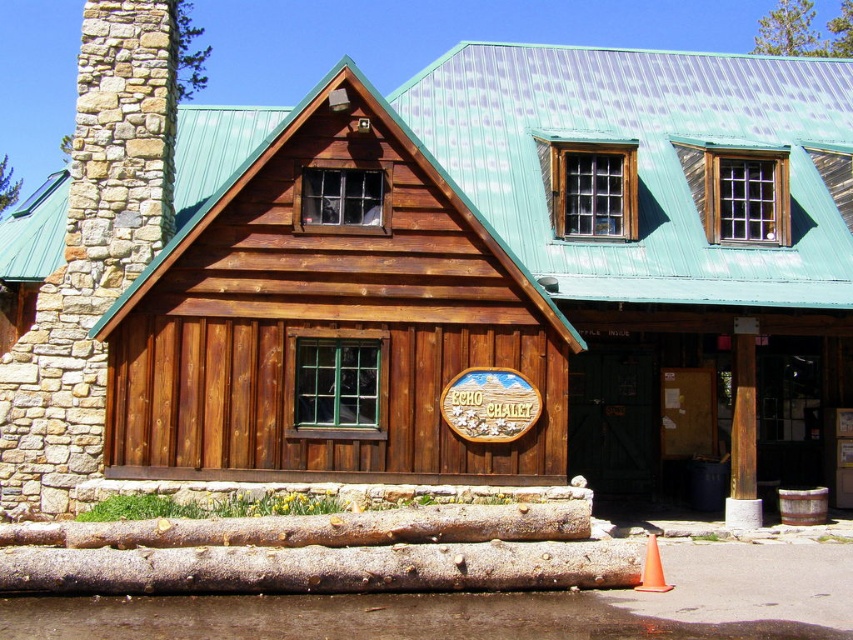
You are a visitor approaching the Echo Chalet and notice the stained wood cabin at center and the orange plastic cone at lower center. Which object appears taller from your perspective?

The orange plastic cone at lower center appears taller than the stained wood cabin at center because the description states that the stained wood cabin at center is not as tall as the orange plastic cone at lower center.

You are a visitor approaching the stained wood cabin at center and the orange plastic cone at lower center. Which object is closer to the entrance of the building?

The orange plastic cone at lower center is closer to the entrance of the building because it is positioned to the right of the stained wood cabin at center, which is further to the left.

You are standing at the base of the orange plastic cone at lower center and want to enter the stained wood cabin at center. Which direction should you move to reach the cabin?

The stained wood cabin at center is located above the orange plastic cone at lower center, so you should move upward or forward towards it to reach the cabin.